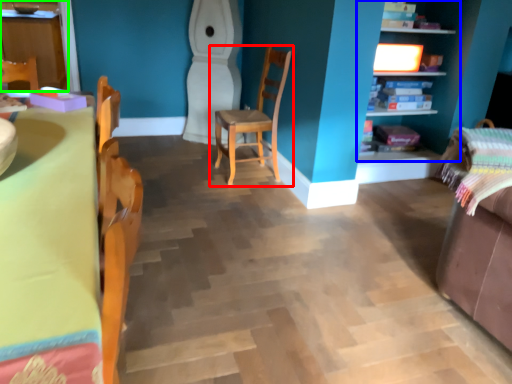
Question: Considering the real-world distances, which object is closest to chair (highlighted by a red box)? shelf (highlighted by a blue box) or cabinetry (highlighted by a green box).

Choices:
 (A) shelf
 (B) cabinetry

Answer: (A)